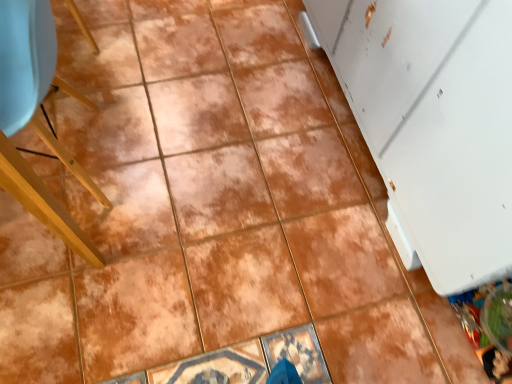
Question: Considering the relative positions of white matte refrigerator at right and matte yellow chair at left in the image provided, is white matte refrigerator at right to the left or to the right of matte yellow chair at left?

Choices:
 (A) right
 (B) left

Answer: (A)

Question: Is white matte refrigerator at right wider or thinner than matte yellow chair at left?

Choices:
 (A) thin
 (B) wide

Answer: (B)

Question: Which is correct: white matte refrigerator at right is inside matte yellow chair at left, or outside of it?

Choices:
 (A) inside
 (B) outside

Answer: (B)

Question: In terms of width, does matte yellow chair at left look wider or thinner when compared to white matte refrigerator at right?

Choices:
 (A) thin
 (B) wide

Answer: (A)

Question: Looking at the image, does matte yellow chair at left seem bigger or smaller compared to white matte refrigerator at right?

Choices:
 (A) small
 (B) big

Answer: (A)

Question: From a real-world perspective, is matte yellow chair at left physically located above or below white matte refrigerator at right?

Choices:
 (A) above
 (B) below

Answer: (B)

Question: Does point (16, 173) appear closer or farther from the camera than point (452, 145)?

Choices:
 (A) farther
 (B) closer

Answer: (B)